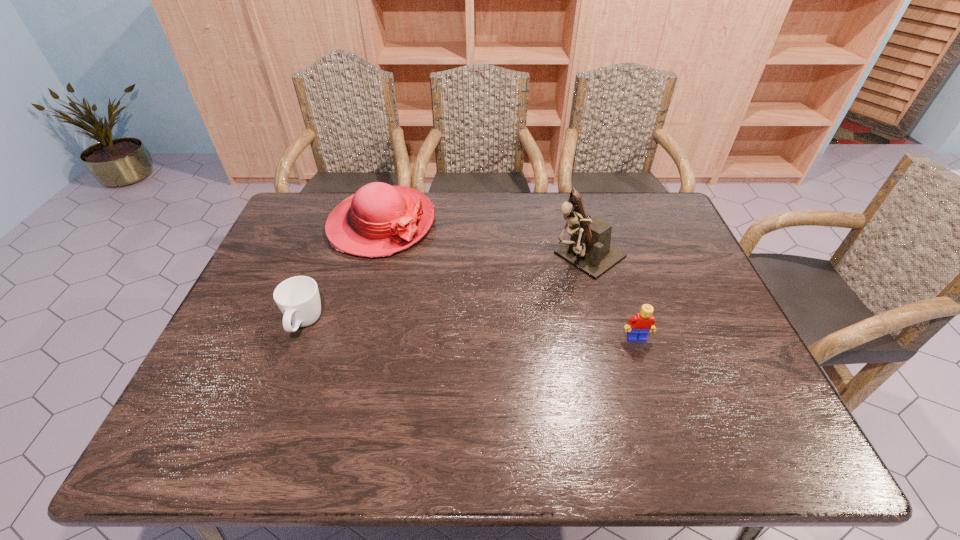
The height and width of the screenshot is (540, 960). What are the coordinates of `empty location between the cup and the Lego` in the screenshot? It's located at (470, 332).

Where is `vacant area between the Lego and the cup`? The image size is (960, 540). vacant area between the Lego and the cup is located at coordinates (470, 332).

Identify the location of free space between the cup and the hat. The image size is (960, 540). (343, 274).

Where is `the second closest object to the cup`? The image size is (960, 540). the second closest object to the cup is located at coordinates (589, 250).

Identify which object is the third nearest to the Lego. Please provide its 2D coordinates. Your answer should be formatted as a tuple, i.e. [(x, y)], where the tuple contains the x and y coordinates of a point satisfying the conditions above.

[(298, 298)]